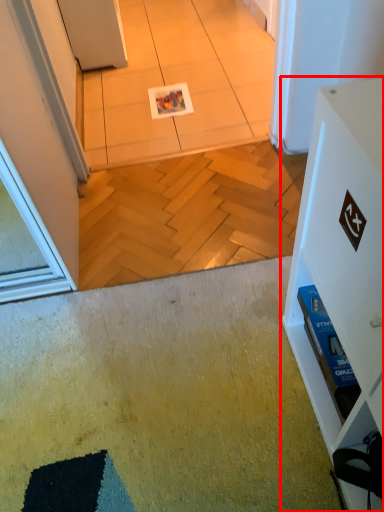
Question: From the image's perspective, where is furniture (annotated by the red box) located in relation to tile in the image?

Choices:
 (A) below
 (B) above

Answer: (A)